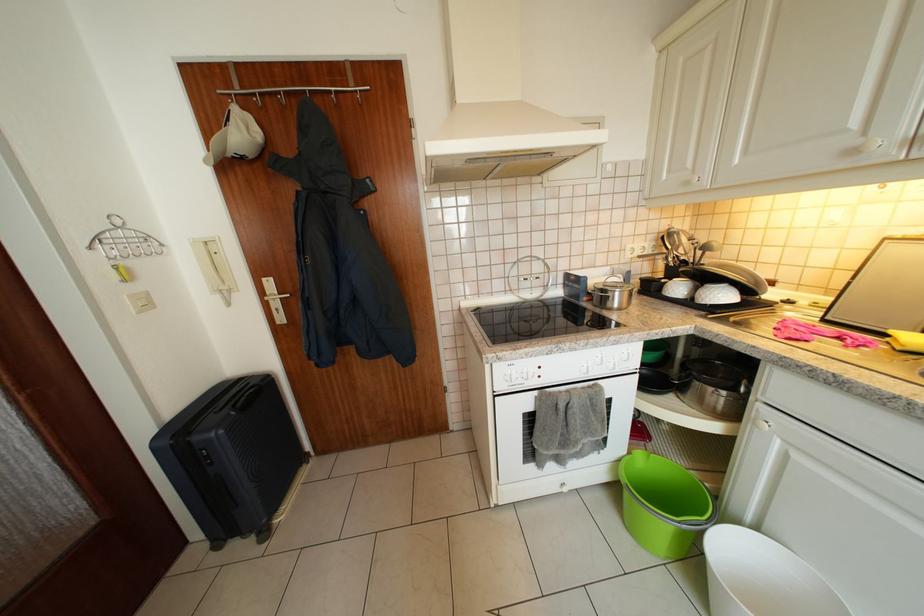
You are a GUI agent. You are given a task and a screenshot of the screen. Output one action in this format:
    pyautogui.click(x=<x>, y=<y>)
    Task: Click on the metal coat hook
    
    Given the screenshot: What is the action you would take?
    pyautogui.click(x=123, y=245)